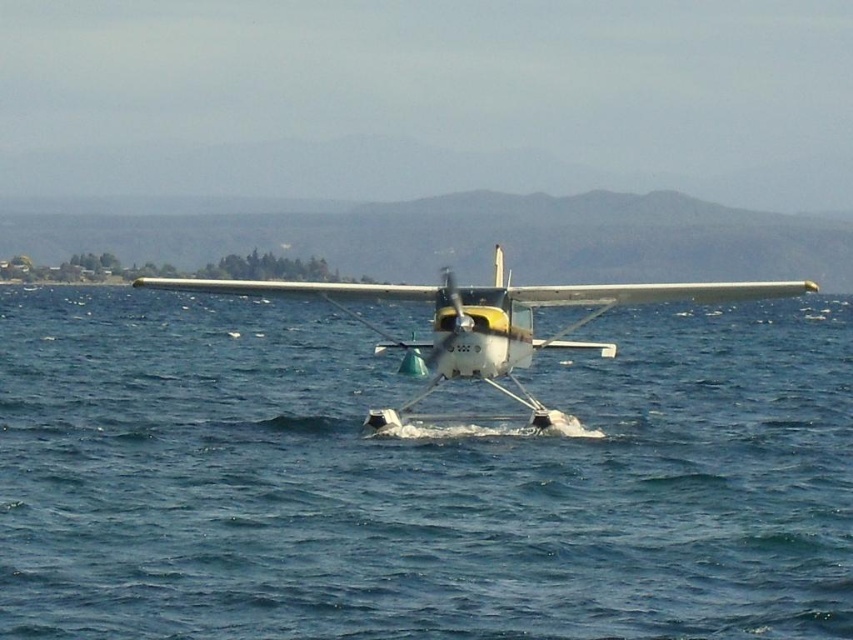
You are standing on the seaplane and looking around. There is a point marked at coordinates (416, 477). What is located at that point?

The point at coordinates (416, 477) indicates blue water at center.

You are a pilot trying to navigate a seaplane to land safely. The blue water at center is the ideal landing spot. According to the coordinates provided, where exactly should you aim your seaplane to land?

You should aim your seaplane to land at the coordinates point (416,477) where the blue water at center is located.

You are standing on a dock and looking at the blue water at center and the white matte seaplane at center. Which object is nearer to you?

The blue water at center is closer to the viewer than the white matte seaplane at center, so the blue water at center is nearer to you.